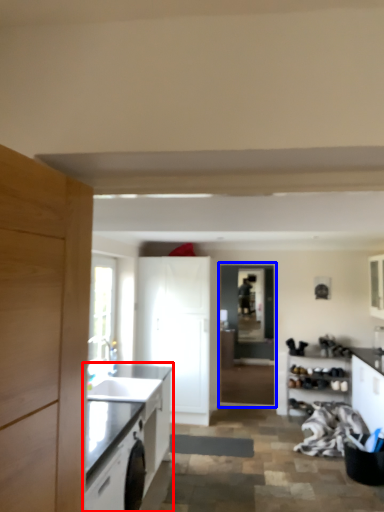
Question: Which point is closer to the camera, cabinetry (highlighted by a red box) or glass door (highlighted by a blue box)?

Choices:
 (A) cabinetry
 (B) glass door

Answer: (A)